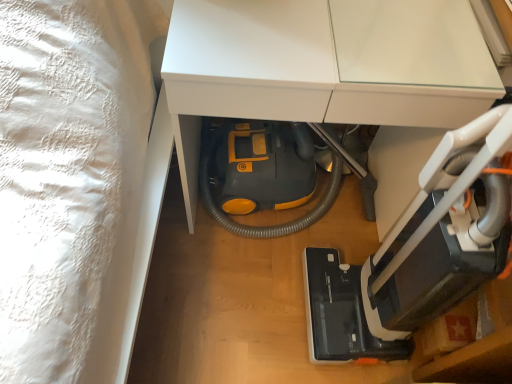
In order to click on free area in between black plastic vacuum cleaner at lower right and yellow plastic vacuum cleaner at lower center in this screenshot , I will do `click(263, 292)`.